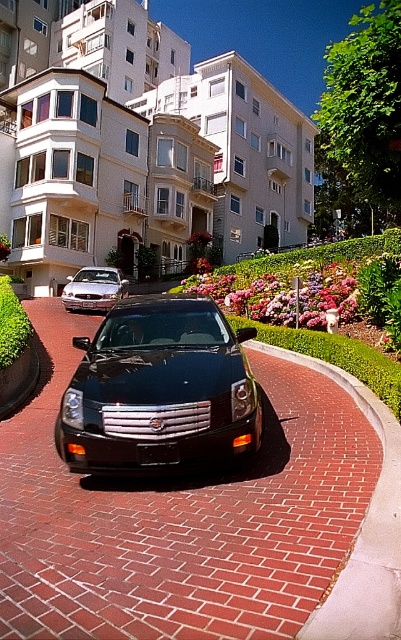
You are standing in front of the apartment complex and want to take a photo that includes both point A at point (202, 564) and point B at point (390, 362). Which point will appear larger in the photo?

Point A at point (202, 564) will appear larger in the photo because it is closer to the camera than point B at point (390, 362).

You are a delivery driver who needs to park your vehicle between the black glossy car at center and the matte silver sedan at center. Which direction should you drive to position your vehicle between them?

The black glossy car at center is below the matte silver sedan at center, so you should drive downward to position your vehicle between them.

You are a delivery person standing at the entrance of the curved brick driveway. You need to load a package onto the black glossy car at center. Can you reach the car without moving from your current position?

The black glossy car at center is 2.59 meters away from the viewer. Since the average person can reach about 2 meters, you cannot reach the car without moving closer.